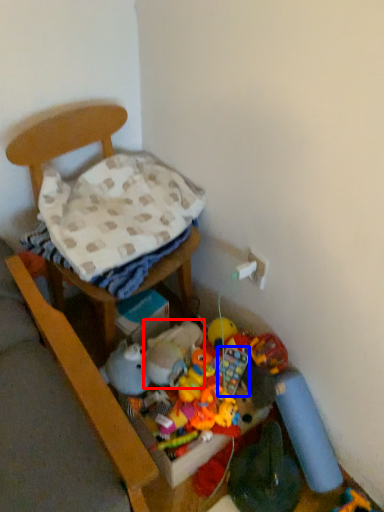
Question: Among these objects, which one is nearest to the camera, toy (highlighted by a red box) or toy (highlighted by a blue box)?

Choices:
 (A) toy
 (B) toy

Answer: (A)